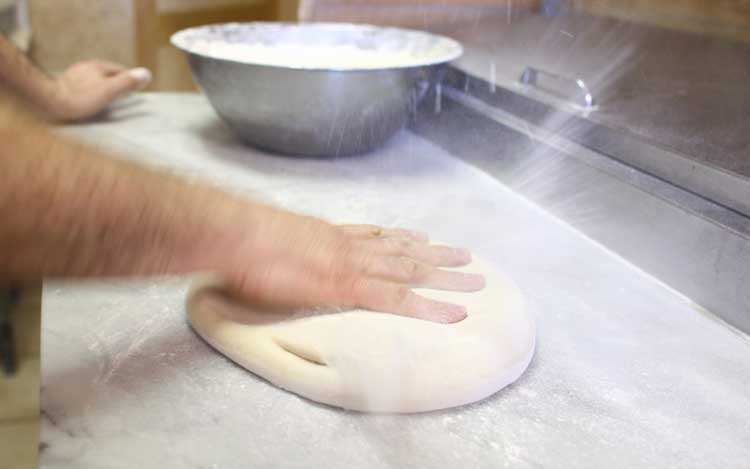
Locate an element on the screen. Image resolution: width=750 pixels, height=469 pixels. inside of bowl is located at coordinates (304, 37).